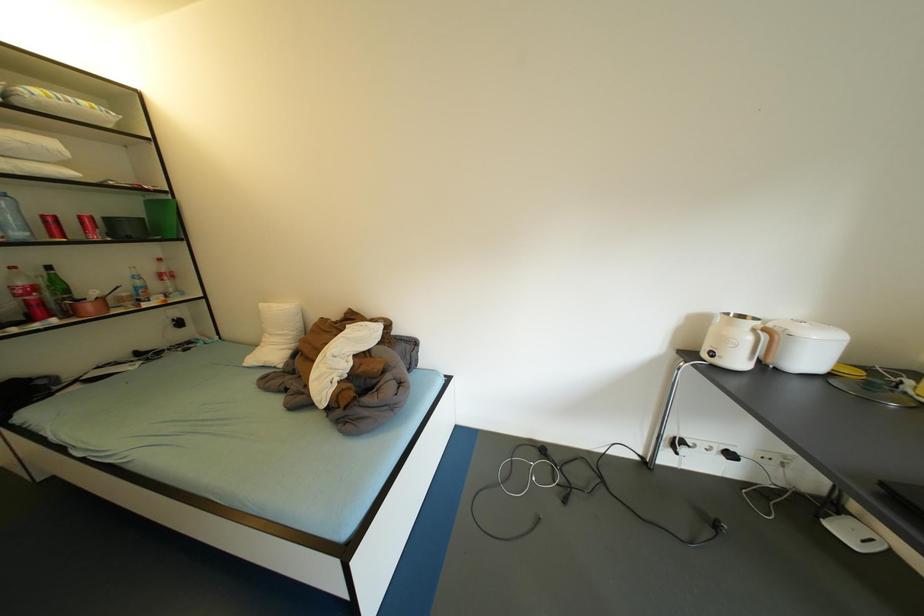
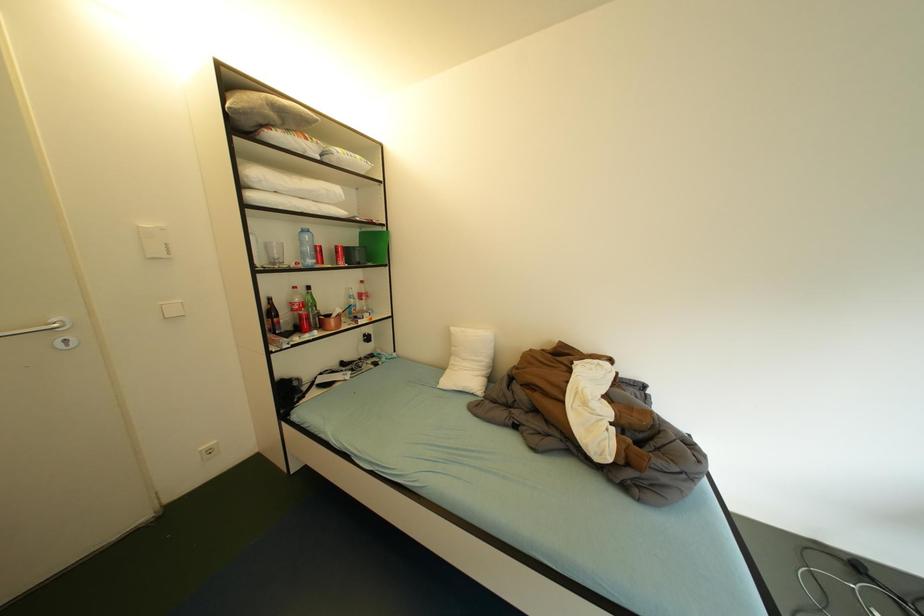
Question: What movement of the cameraman would produce the second image?

Choices:
 (A) Left
 (B) Right
 (C) Forward
 (D) Backward

Answer: (A)